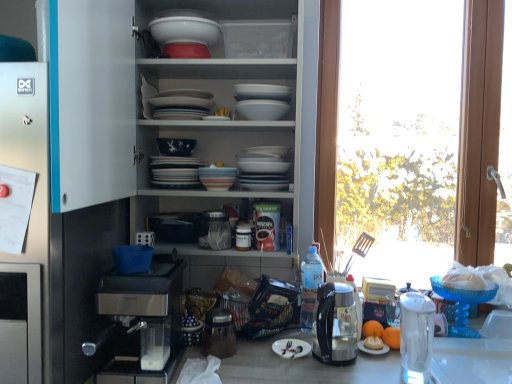
Question: Looking at the image, does white glossy bowl at upper center, which is counted as the first appliance, starting from the top, seem bigger or smaller compared to transparent glass window at right?

Choices:
 (A) big
 (B) small

Answer: (B)

Question: Is white glossy bowl at upper center, the fourth appliance positioned from the bottom, taller or shorter than transparent glass window at right?

Choices:
 (A) tall
 (B) short

Answer: (B)

Question: Estimate the real-world distances between objects in this image. Which object is farther from the transparent glass water at right, positioned as the 4th appliance in left-to-right order?

Choices:
 (A) transparent glass jar at center, the 2th appliance viewed from the left
 (B) white glossy plate at center, which is the first tableware from bottom to top
 (C) white glossy bowls at upper center
 (D) clear plastic bottle at center
 (E) orange matte at right

Answer: (C)

Question: Based on their relative distances, which object is farther from the clear plastic bottle at center?

Choices:
 (A) white glossy bowl at upper center, which is counted as the first appliance, starting from the top
 (B) white glossy bowls at upper center
 (C) white glossy plate at center, which ranks as the 2th tableware in right-to-left order
 (D) orange matte at right
 (E) blue glass cake stand at right, which is the second tableware in bottom-to-top order

Answer: (A)